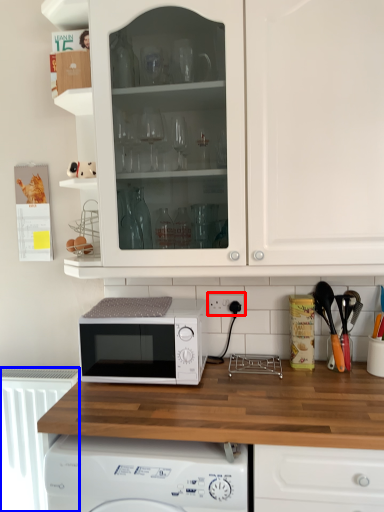
Question: Among these objects, which one is nearest to the camera, electric outlet (highlighted by a red box) or radiator (highlighted by a blue box)?

Choices:
 (A) electric outlet
 (B) radiator

Answer: (A)